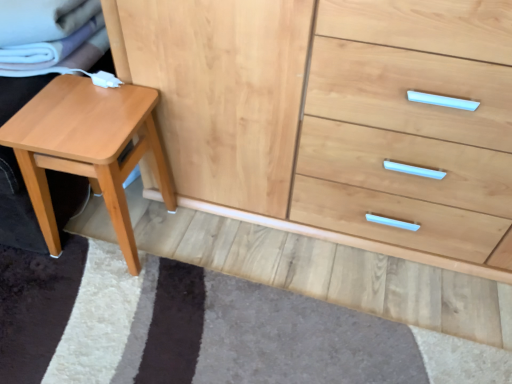
Question: Relative to natural wood chest of drawers at center, is light brown wood stool at left in front or behind?

Choices:
 (A) behind
 (B) front

Answer: (A)

Question: From a real-world perspective, is light brown wood stool at left above or below natural wood chest of drawers at center?

Choices:
 (A) above
 (B) below

Answer: (B)

Question: From the image's perspective, is light brown wood stool at left positioned above or below natural wood chest of drawers at center?

Choices:
 (A) below
 (B) above

Answer: (A)

Question: From the image's perspective, is natural wood chest of drawers at center positioned above or below light brown wood stool at left?

Choices:
 (A) below
 (B) above

Answer: (B)

Question: Is natural wood chest of drawers at center bigger or smaller than light brown wood stool at left?

Choices:
 (A) big
 (B) small

Answer: (A)

Question: From their relative heights in the image, would you say natural wood chest of drawers at center is taller or shorter than light brown wood stool at left?

Choices:
 (A) tall
 (B) short

Answer: (A)

Question: Would you say natural wood chest of drawers at center is to the left or to the right of light brown wood stool at left in the picture?

Choices:
 (A) right
 (B) left

Answer: (A)